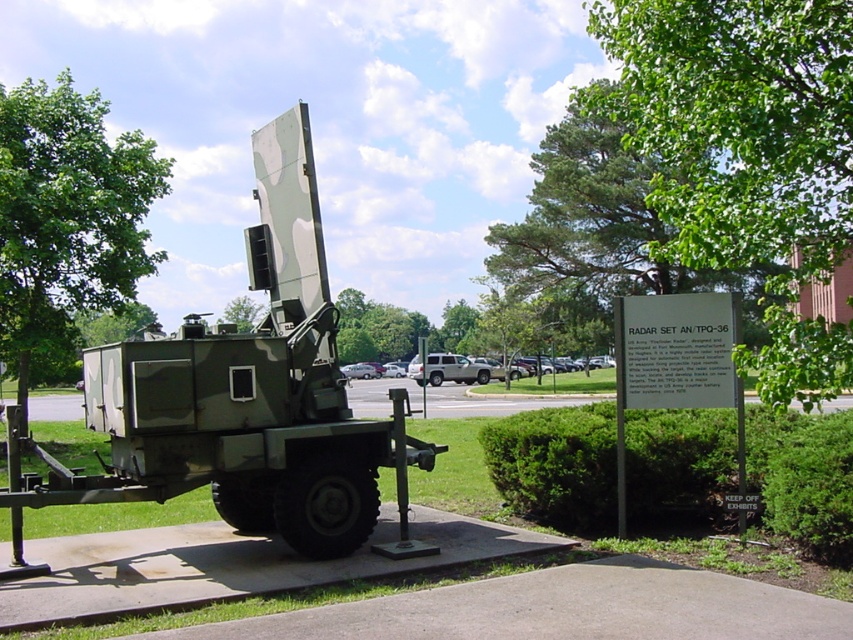
You are a photographer planning to take a photo of the camouflage painted radar set at center and the silver metallic suv at center. Which object should you focus on first if you want to capture both in a single frame without adjusting your camera settings, considering their heights?

The camouflage painted radar set at center is not as tall as the silver metallic suv at center, so you should focus on the silver metallic suv at center first since it is taller and requires proper focus to ensure both are in the frame.

Consider the image. What are the coordinates of the camouflage painted radar set at center?

The camouflage painted radar set at center is located at point (241, 396).